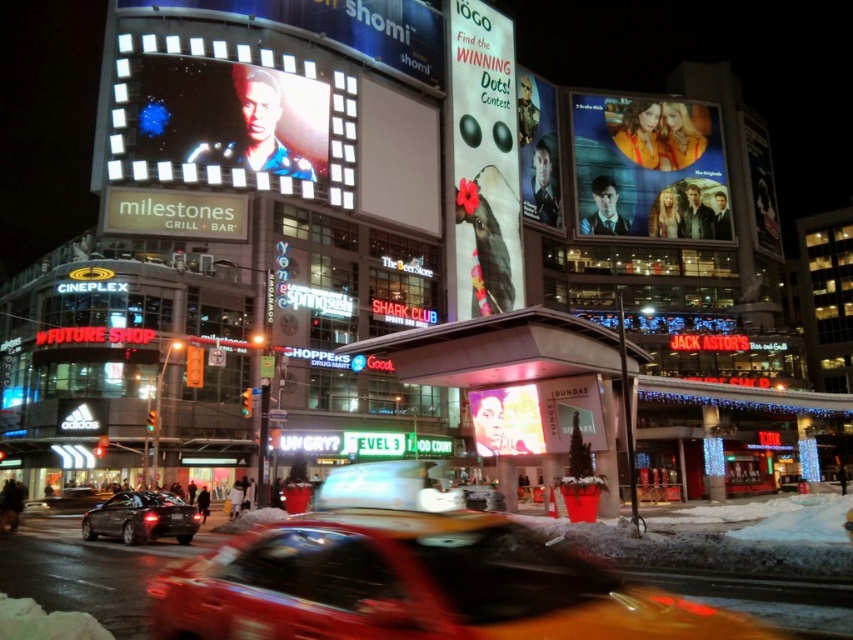
You are a pedestrian standing at the intersection and want to cross the street. There is a yellow rubber taxi at center and a shiny black sedan at lower left. Which vehicle is closer to your left side?

The shiny black sedan at lower left is closer to your left side because it is positioned to the left of the yellow rubber taxi at center.

You are a delivery driver in the city at night. Your GPS says you need to turn left at the next intersection. You see the red taxi in motion in the foreground and the large digital billboard for milestones GRILL BAR at upper left. Which object is closer to you, the red taxi in motion or the point at (334, 28)?

The red taxi in motion is closer to you because it is in the foreground, while the point at (334, 28) is part of the matte digital billboard at upper left located in the background.